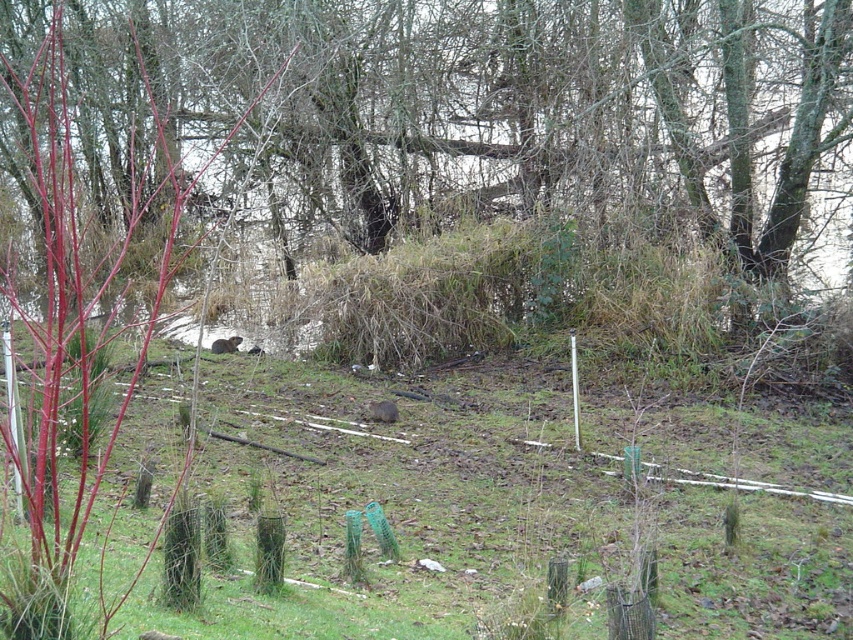
The width and height of the screenshot is (853, 640). I want to click on brown grass at center, so click(482, 115).

Does brown grass at center have a lesser height compared to green grassy at center?

Incorrect, brown grass at center's height does not fall short of green grassy at center's.

Which is behind, point (71, 84) or point (343, 536)?

The point (71, 84) is behind.

Find the location of a particular element. This screenshot has width=853, height=640. brown grass at center is located at coordinates (482, 115).

Is brown furry rodent at center to the right of brown furry animal at center from the viewer's perspective?

Correct, you'll find brown furry rodent at center to the right of brown furry animal at center.

Can you confirm if brown furry rodent at center is bigger than brown furry animal at center?

Actually, brown furry rodent at center might be smaller than brown furry animal at center.

Is point (386, 417) farther from viewer compared to point (224, 340)?

No, it is not.

Where is `brown furry rodent at center`? brown furry rodent at center is located at coordinates pos(381,412).

Which is above, brown grass at center or brown furry rodent at center?

brown grass at center is above.

Can you confirm if brown grass at center is positioned above brown furry rodent at center?

Correct, brown grass at center is located above brown furry rodent at center.

Which is behind, point (509, 74) or point (395, 410)?

Positioned behind is point (509, 74).

Identify the location of brown grass at center. (482, 115).